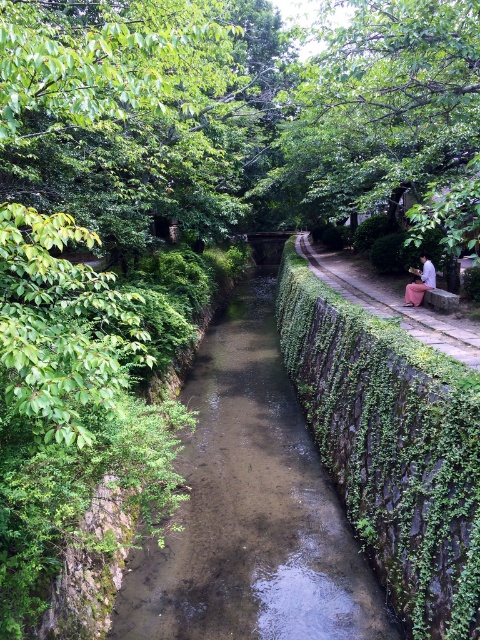
Question: Which of these objects is positioned closest to the pink fabric at right?

Choices:
 (A) light pink fabric at right
 (B) clear water stream at center
 (C) green ivy hedge at right

Answer: (C)

Question: Considering the real-world distances, which object is closest to the clear water stream at center?

Choices:
 (A) green ivy hedge at right
 (B) pink fabric at right

Answer: (A)

Question: Is the position of clear water stream at center more distant than that of green ivy hedge at right?

Choices:
 (A) yes
 (B) no

Answer: (A)

Question: Does clear water stream at center appear over light pink fabric at right?

Choices:
 (A) no
 (B) yes

Answer: (A)

Question: Is green ivy hedge at right below light pink fabric at right?

Choices:
 (A) no
 (B) yes

Answer: (B)

Question: Which point is farther from the camera taking this photo?

Choices:
 (A) (333, 540)
 (B) (420, 280)
 (C) (463, 358)
 (D) (382, 435)

Answer: (B)